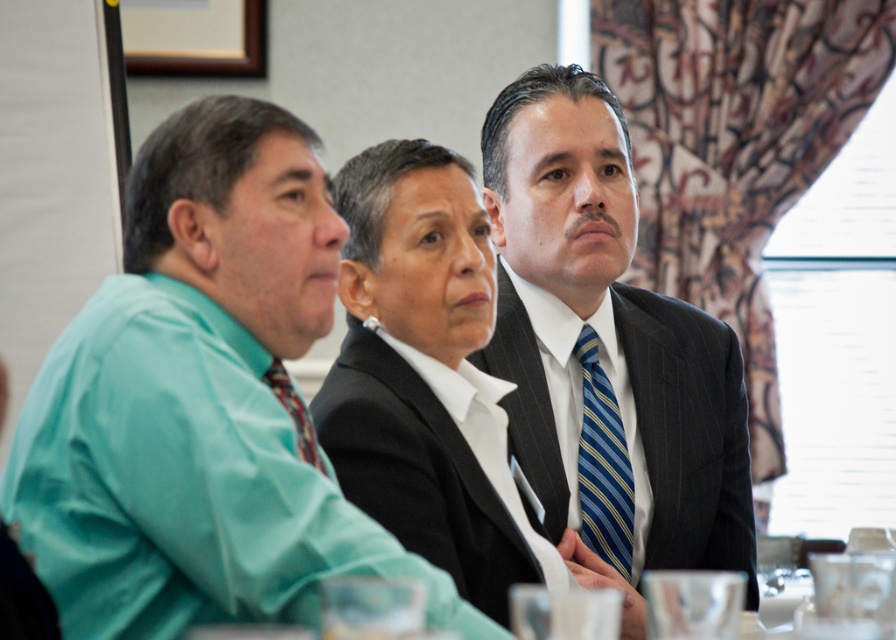
Can you confirm if dark gray suit at center is smaller than striped silk tie at left?

Incorrect, dark gray suit at center is not smaller in size than striped silk tie at left.

Which of these two, dark gray suit at center or striped silk tie at left, stands shorter?

striped silk tie at left

Does point (378, 275) lie behind point (297, 449)?

Yes, it is.

Locate an element on the screen. The height and width of the screenshot is (640, 896). dark gray suit at center is located at coordinates (427, 376).

Does dark gray pinstripe suit at center have a lesser height compared to striped silk tie at left?

In fact, dark gray pinstripe suit at center may be taller than striped silk tie at left.

Is dark gray pinstripe suit at center positioned at the back of striped silk tie at left?

Yes, it is.

Does point (515, 396) come in front of point (285, 387)?

No, (515, 396) is further to viewer.

You are a GUI agent. You are given a task and a screenshot of the screen. Output one action in this format:
    pyautogui.click(x=<x>, y=<y>)
    Task: Click on the dark gray pinstripe suit at center
    
    Given the screenshot: What is the action you would take?
    pyautogui.click(x=606, y=348)

Is the position of teal fabric shirt at left less distant than that of striped silk tie at left?

Yes, it is in front of striped silk tie at left.

Is teal fabric shirt at left to the right of striped silk tie at left from the viewer's perspective?

In fact, teal fabric shirt at left is to the left of striped silk tie at left.

Does point (131, 524) come behind point (289, 380)?

That is False.

Locate an element on the screen. This screenshot has height=640, width=896. teal fabric shirt at left is located at coordinates (199, 401).